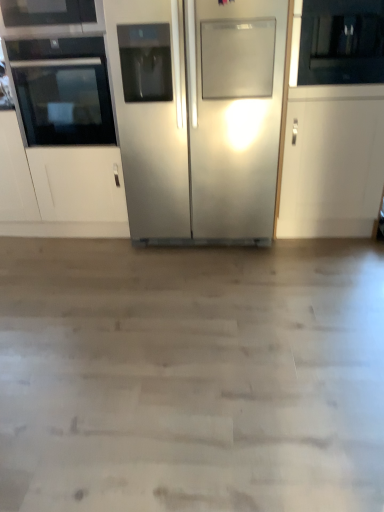
In the scene shown: Measure the distance between point (203,68) and camera.

The depth of point (203,68) is 2.16 meters.

What are the coordinates of `stainless steel refrigerator at center` in the screenshot? It's located at (204, 120).

What do you see at coordinates (204, 120) in the screenshot? I see `stainless steel refrigerator at center` at bounding box center [204, 120].

This screenshot has width=384, height=512. What do you see at coordinates (63, 91) in the screenshot? I see `black glass oven at left` at bounding box center [63, 91].

Find the location of a particular element. Image resolution: width=384 pixels, height=512 pixels. black glass oven at left is located at coordinates (63, 91).

I want to click on stainless steel refrigerator at center, so click(204, 120).

Considering the relative positions of stainless steel refrigerator at center and black glass oven at left in the image provided, is stainless steel refrigerator at center to the left of black glass oven at left from the viewer's perspective?

Incorrect, stainless steel refrigerator at center is not on the left side of black glass oven at left.

Which object is closer to the camera, stainless steel refrigerator at center or black glass oven at left?

stainless steel refrigerator at center is more forward.

Is point (161, 223) positioned before point (76, 125)?

That is False.

From the image's perspective, which is below, stainless steel refrigerator at center or black glass oven at left?

stainless steel refrigerator at center is shown below in the image.

From a real-world perspective, is stainless steel refrigerator at center on black glass oven at left?

No, from a real-world perspective, stainless steel refrigerator at center is not above black glass oven at left.

Which object is thinner, stainless steel refrigerator at center or black glass oven at left?

black glass oven at left is thinner.

Is stainless steel refrigerator at center taller or shorter than black glass oven at left?

In the image, stainless steel refrigerator at center appears to be taller than black glass oven at left.

Can you confirm if stainless steel refrigerator at center is smaller than black glass oven at left?

Incorrect, stainless steel refrigerator at center is not smaller in size than black glass oven at left.

Would you say stainless steel refrigerator at center contains black glass oven at left?

No, black glass oven at left is not inside stainless steel refrigerator at center.

Is stainless steel refrigerator at center far from black glass oven at left?

stainless steel refrigerator at center is near black glass oven at left, not far away.

Is stainless steel refrigerator at center oriented towards black glass oven at left?

No, stainless steel refrigerator at center is not aimed at black glass oven at left.

How different are the orientations of stainless steel refrigerator at center and black glass oven at left in degrees?

There is a 0.126-degree angle between the facing directions of stainless steel refrigerator at center and black glass oven at left.

You are a GUI agent. You are given a task and a screenshot of the screen. Output one action in this format:
    pyautogui.click(x=<x>, y=<y>)
    Task: Click on the refrigerator in front of the black glass oven at left
    The height and width of the screenshot is (512, 384).
    Given the screenshot: What is the action you would take?
    pyautogui.click(x=204, y=120)

Based on the photo, is black glass oven at left at the left side of stainless steel refrigerator at center?

Yes, black glass oven at left is to the left of stainless steel refrigerator at center.

Is the depth of black glass oven at left less than that of stainless steel refrigerator at center?

No, black glass oven at left is further to the viewer.

Which is closer, (24, 70) or (194, 120)?

Point (24, 70) is positioned farther from the camera compared to point (194, 120).

From the image's perspective, does black glass oven at left appear higher than stainless steel refrigerator at center?

Correct, black glass oven at left appears higher than stainless steel refrigerator at center in the image.

From a real-world perspective, who is located lower, black glass oven at left or stainless steel refrigerator at center?

From a 3D spatial view, stainless steel refrigerator at center is below.

Can you confirm if black glass oven at left is wider than stainless steel refrigerator at center?

Incorrect, the width of black glass oven at left does not surpass that of stainless steel refrigerator at center.

Who is taller, black glass oven at left or stainless steel refrigerator at center?

stainless steel refrigerator at center.

Can you confirm if black glass oven at left is smaller than stainless steel refrigerator at center?

Correct, black glass oven at left occupies less space than stainless steel refrigerator at center.

Can stainless steel refrigerator at center be found inside black glass oven at left?

No.

Are black glass oven at left and stainless steel refrigerator at center located far from each other?

No, black glass oven at left is not far from stainless steel refrigerator at center.

Is black glass oven at left turned away from stainless steel refrigerator at center?

That's not correct — black glass oven at left is not looking away from stainless steel refrigerator at center.

Can you tell me how much black glass oven at left and stainless steel refrigerator at center differ in facing direction?

The facing directions of black glass oven at left and stainless steel refrigerator at center are 0.126 degrees apart.

How much distance is there between black glass oven at left and stainless steel refrigerator at center?

black glass oven at left and stainless steel refrigerator at center are 19.37 inches apart from each other.

Where is `oven above the stainless steel refrigerator at center (from a real-world perspective)`? oven above the stainless steel refrigerator at center (from a real-world perspective) is located at coordinates (63, 91).

This screenshot has width=384, height=512. I want to click on refrigerator on the right side of black glass oven at left, so click(204, 120).

Where is `oven on the left of stainless steel refrigerator at center`? The width and height of the screenshot is (384, 512). oven on the left of stainless steel refrigerator at center is located at coordinates (63, 91).